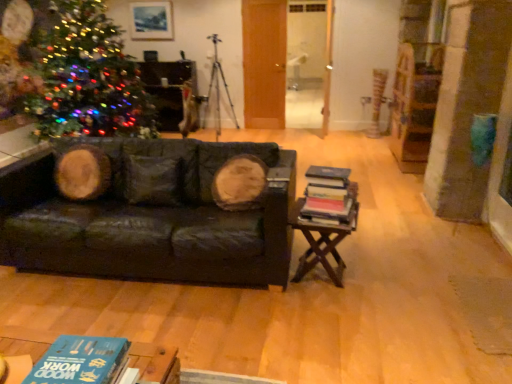
Locate an element on the screen. The height and width of the screenshot is (384, 512). empty space that is ontop of hardcover books at right, the 2th book when ordered from bottom to top (from a real-world perspective) is located at coordinates (328, 173).